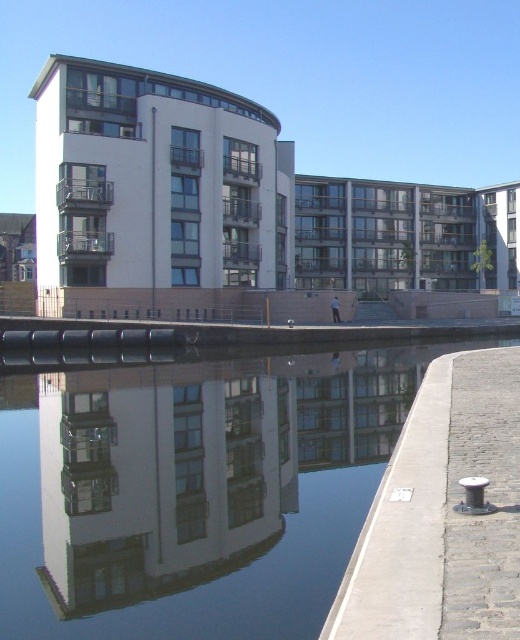
You are standing on the gray cobblestone pavement at lower right and want to step onto the concrete at lower right. Considering their heights, will you need to climb up or step down to move from the gray cobblestone pavement to the concrete?

The concrete at lower right has a greater height compared to the gray cobblestone pavement at lower right, so you will need to climb up to move from the gray cobblestone pavement to the concrete.

Consider the image. You are standing on the walkway and want to cross to the other side. The transparent glass canal at lower left and the concrete at lower right are both in your path. Which surface should you avoid stepping on to stay safe?

You should avoid stepping on the transparent glass canal at lower left because it is further to the viewer than the concrete at lower right, making it closer to your current position and potentially unsafe to walk on.

You are a delivery person carrying a heavy box and need to move from the concrete at lower right to the gray cobblestone pavement at lower right. Can you step from one to the other without needing to jump?

The concrete at lower right is 9.21 inches away from the gray cobblestone pavement at lower right. Since this distance is within a comfortable stepping range for most people, you can step from the concrete at lower right to the gray cobblestone pavement at lower right without needing to jump.